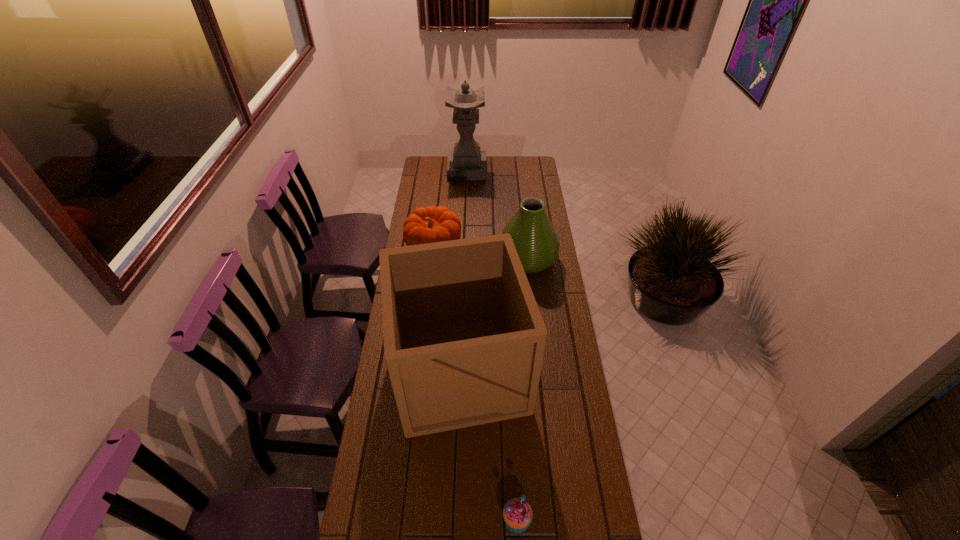
Identify the location of free space at the far right corner of the desktop. The width and height of the screenshot is (960, 540). (516, 161).

The image size is (960, 540). I want to click on free spot between the shortest object and the box, so click(489, 445).

Locate an element on the screen. This screenshot has width=960, height=540. empty space between the fourth shortest object and the muffin is located at coordinates (489, 445).

This screenshot has height=540, width=960. I want to click on the fourth closest object to the vase, so click(517, 513).

Identify which object is located as the second nearest to the second shortest object. Please provide its 2D coordinates. Your answer should be formatted as a tuple, i.e. [(x, y)], where the tuple contains the x and y coordinates of a point satisfying the conditions above.

[(464, 340)]

The image size is (960, 540). I want to click on free space that satisfies the following two spatial constraints: 1. at the front opening of the sculpture; 2. on the right side of the box, so click(460, 371).

At what (x,y) coordinates should I click in order to perform the action: click on vacant area in the image that satisfies the following two spatial constraints: 1. on the front side of the fourth shortest object; 2. on the right side of the pumpkin. Please return your answer as a coordinate pair (x, y). Looking at the image, I should click on (420, 371).

Identify the location of vacant region that satisfies the following two spatial constraints: 1. on the front side of the vase; 2. on the right side of the second shortest object. (432, 259).

At what (x,y) coordinates should I click in order to perform the action: click on blank area in the image that satisfies the following two spatial constraints: 1. on the front side of the fourth farthest object; 2. on the right side of the pumpkin. Please return your answer as a coordinate pair (x, y). Looking at the image, I should click on (420, 371).

The width and height of the screenshot is (960, 540). In order to click on blank space that satisfies the following two spatial constraints: 1. at the front opening of the box; 2. on the right side of the farthest object in this screenshot , I will do `click(460, 371)`.